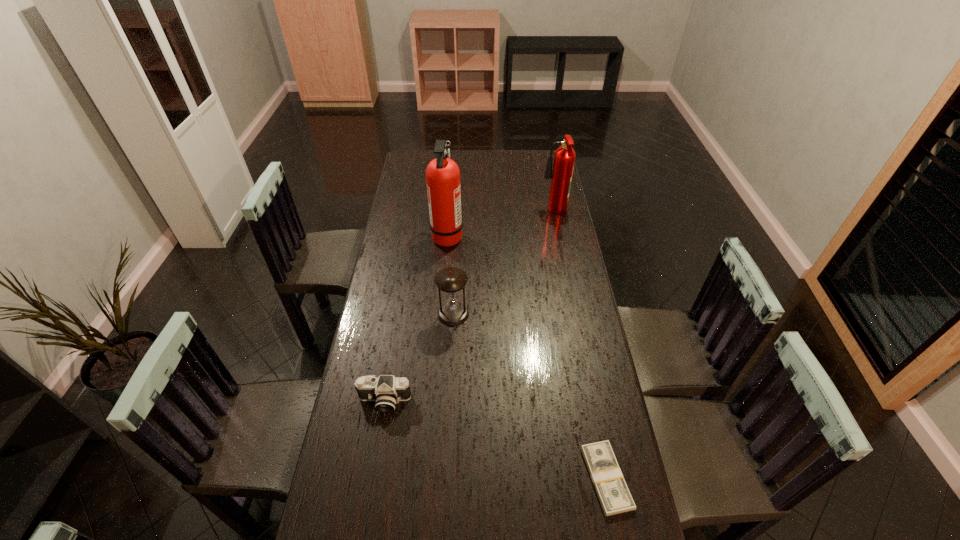
You are a GUI agent. You are given a task and a screenshot of the screen. Output one action in this format:
    pyautogui.click(x=<x>, y=<y>)
    Task: Click on the vacant space that satisfies the following two spatial constraints: 1. on the handle side of the taller fire extinguisher; 2. on the back side of the nearest object
    The image size is (960, 540).
    Given the screenshot: What is the action you would take?
    pyautogui.click(x=428, y=478)

Locate an element on the screen. The height and width of the screenshot is (540, 960). free space that satisfies the following two spatial constraints: 1. at the nozzle of the shorter fire extinguisher; 2. on the front side of the third shortest object is located at coordinates (574, 314).